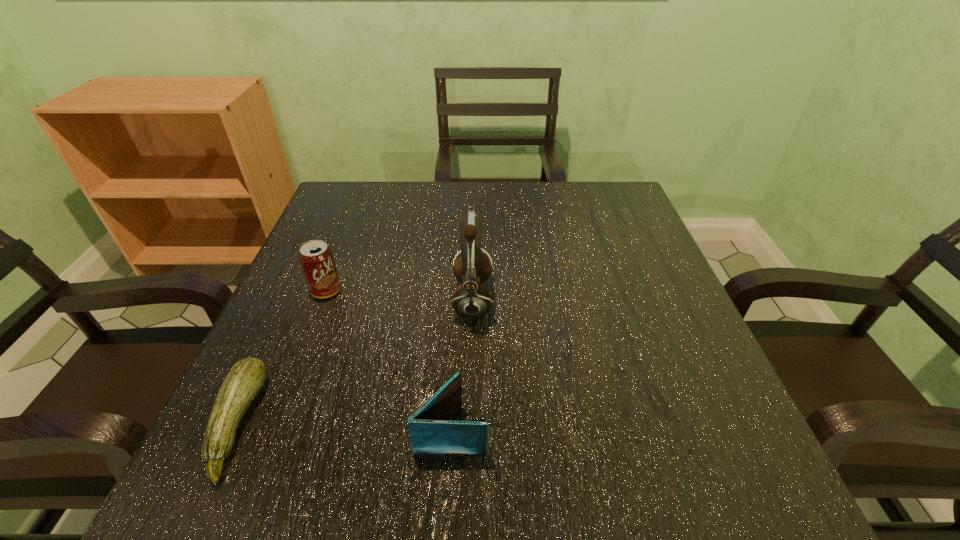
At what (x,y) coordinates should I click in order to perform the action: click on free space at the near left corner of the desktop. Please return your answer as a coordinate pair (x, y). This screenshot has width=960, height=540. Looking at the image, I should click on (200, 485).

Where is `vacant space at the far right corner of the desktop`? This screenshot has height=540, width=960. vacant space at the far right corner of the desktop is located at coordinates (573, 195).

Locate an element on the screen. This screenshot has width=960, height=540. free space between the wallet and the second tallest object is located at coordinates (389, 360).

Where is `free point between the second object from left to right and the tallest object`? This screenshot has width=960, height=540. free point between the second object from left to right and the tallest object is located at coordinates (399, 295).

Locate an element on the screen. vacant region between the third object from right to left and the leftmost object is located at coordinates (281, 357).

Locate an element on the screen. The height and width of the screenshot is (540, 960). vacant space that is in between the zucchini and the second tallest object is located at coordinates (281, 357).

Locate an element on the screen. This screenshot has height=540, width=960. empty space that is in between the tallest object and the wallet is located at coordinates (462, 365).

Locate an element on the screen. This screenshot has height=540, width=960. unoccupied position between the wallet and the leftmost object is located at coordinates (344, 427).

You are a GUI agent. You are given a task and a screenshot of the screen. Output one action in this format:
    pyautogui.click(x=<x>, y=<y>)
    Task: Click on the free area in between the tallest object and the second object from left to right
    This screenshot has width=960, height=540.
    Given the screenshot: What is the action you would take?
    pyautogui.click(x=399, y=295)

The image size is (960, 540). What are the coordinates of `vacant space that is in between the third tallest object and the shortest object` in the screenshot? It's located at point(344,427).